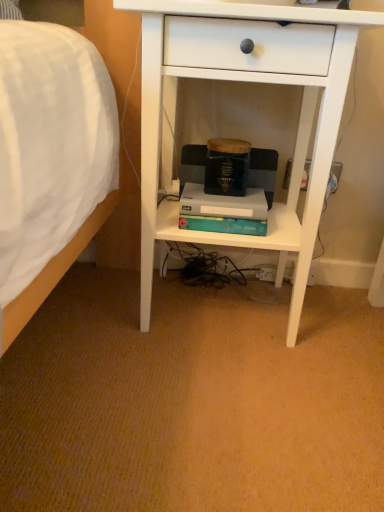
This screenshot has width=384, height=512. What are the coordinates of `free spot in front of white matte desk at center` in the screenshot? It's located at (208, 407).